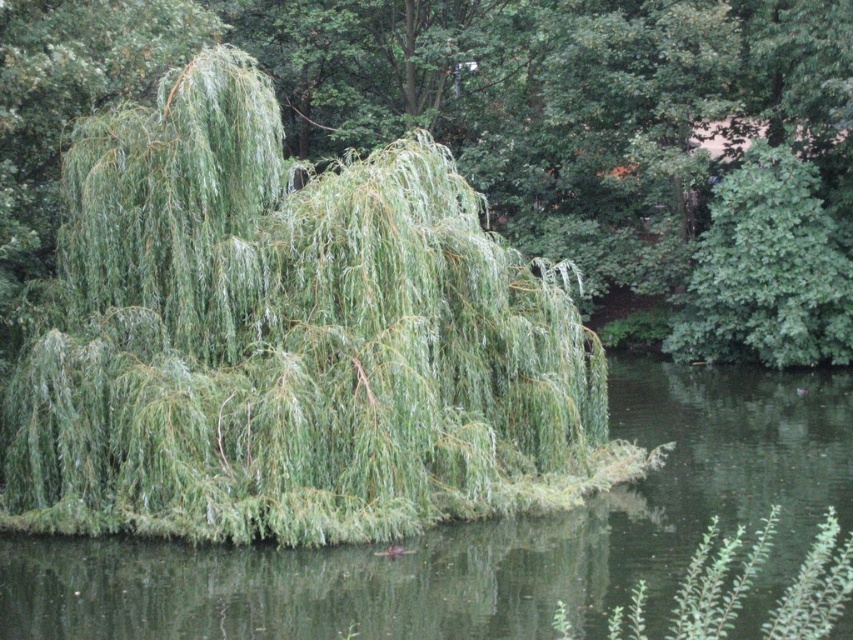
Question: Is green leafy tree at center to the right of green leafy lake at center from the viewer's perspective?

Choices:
 (A) yes
 (B) no

Answer: (B)

Question: Is the position of green leafy willow at center more distant than that of green leafy tree at center?

Choices:
 (A) no
 (B) yes

Answer: (A)

Question: Does green leafy tree at center have a larger size compared to green leafy lake at center?

Choices:
 (A) no
 (B) yes

Answer: (B)

Question: Which point is closer to the camera taking this photo?

Choices:
 (A) (787, 451)
 (B) (465, 337)

Answer: (B)

Question: Estimate the real-world distances between objects in this image. Which object is closer to the green leafy tree at center?

Choices:
 (A) green leafy lake at center
 (B) green leafy willow at center

Answer: (A)

Question: Which of the following is the farthest from the observer?

Choices:
 (A) green leafy tree at center
 (B) green leafy lake at center
 (C) green leafy willow at center

Answer: (A)